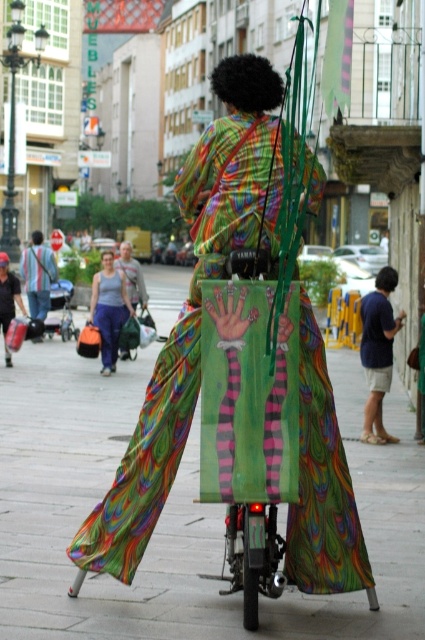
Question: Can you confirm if matte gray tank top at center is thinner than green fabric bag at center?

Choices:
 (A) no
 (B) yes

Answer: (B)

Question: Which of the following is the closest to the observer?

Choices:
 (A) pyautogui.click(x=365, y=579)
 (B) pyautogui.click(x=138, y=289)

Answer: (A)

Question: Which of the following is the closest to the observer?

Choices:
 (A) smooth concrete pavement at center
 (B) matte black bag at left
 (C) blue cotton shirt at lower right

Answer: (A)

Question: Can you confirm if smooth concrete pavement at center is positioned above green fabric bag at center?

Choices:
 (A) yes
 (B) no

Answer: (B)

Question: Can you confirm if matte black bag at left is positioned below green fabric bag at center?

Choices:
 (A) no
 (B) yes

Answer: (B)

Question: Which of the following is the closest to the observer?

Choices:
 (A) (31, 259)
 (B) (125, 262)
 (C) (112, 308)

Answer: (C)